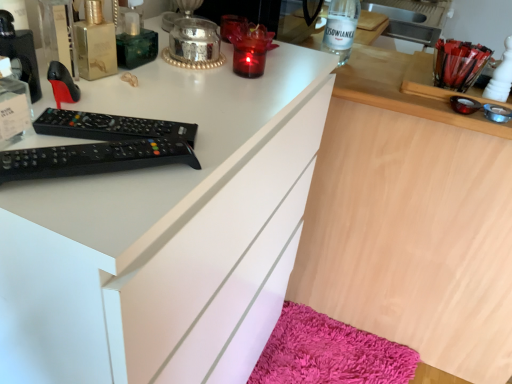
Question: Should I look upward or downward to see wooden desk at center?

Choices:
 (A) down
 (B) up

Answer: (B)

Question: Is black plastic remote control at upper left aimed at shaggy pink bath mat at lower right?

Choices:
 (A) yes
 (B) no

Answer: (B)

Question: Can you confirm if black plastic remote control at upper left is shorter than shaggy pink bath mat at lower right?

Choices:
 (A) no
 (B) yes

Answer: (B)

Question: Is black plastic remote control at upper left not near shaggy pink bath mat at lower right?

Choices:
 (A) no
 (B) yes

Answer: (B)

Question: From the image's perspective, is black plastic remote control at upper left beneath shaggy pink bath mat at lower right?

Choices:
 (A) no
 (B) yes

Answer: (A)

Question: Is black plastic remote control at upper left turned away from shaggy pink bath mat at lower right?

Choices:
 (A) no
 (B) yes

Answer: (A)

Question: Is black plastic remote control at upper left directly adjacent to shaggy pink bath mat at lower right?

Choices:
 (A) yes
 (B) no

Answer: (B)

Question: Does white matte cabinet at center have a larger size compared to wooden desk at center?

Choices:
 (A) no
 (B) yes

Answer: (A)

Question: Is white matte cabinet at center outside of wooden desk at center?

Choices:
 (A) no
 (B) yes

Answer: (B)

Question: Is white matte cabinet at center beside wooden desk at center?

Choices:
 (A) yes
 (B) no

Answer: (B)

Question: Is white matte cabinet at center behind wooden desk at center?

Choices:
 (A) yes
 (B) no

Answer: (B)

Question: Does white matte cabinet at center have a lesser height compared to wooden desk at center?

Choices:
 (A) yes
 (B) no

Answer: (B)

Question: Is white matte cabinet at center smaller than wooden desk at center?

Choices:
 (A) yes
 (B) no

Answer: (A)

Question: From the image's perspective, does wooden desk at center appear higher than clear glass bottle at upper center?

Choices:
 (A) no
 (B) yes

Answer: (A)